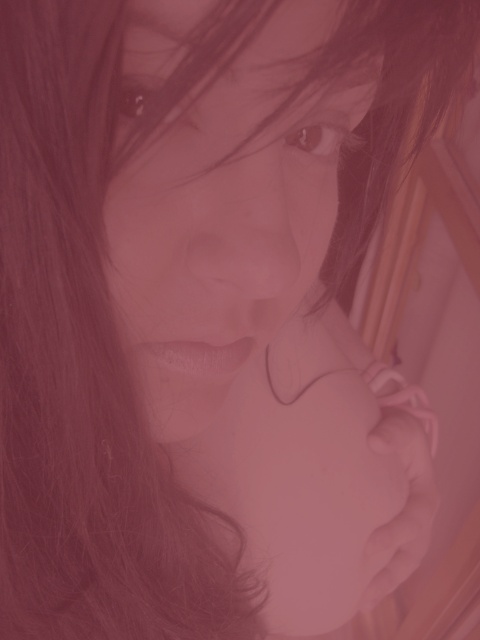
Measure the distance between smooth skin nose at center and camera.

A distance of 22.77 centimeters exists between smooth skin nose at center and camera.

Is smooth skin nose at center taller than matte black eye at upper center?

Yes, smooth skin nose at center is taller than matte black eye at upper center.

Where is `smooth skin nose at center`? The width and height of the screenshot is (480, 640). smooth skin nose at center is located at coordinates (243, 227).

Is smooth skin face at center above matte black eye at upper center?

Actually, smooth skin face at center is below matte black eye at upper center.

Who is taller, smooth skin face at center or matte black eye at upper center?

smooth skin face at center is taller.

Is point (294, 177) positioned after point (119, 104)?

Yes, point (294, 177) is behind point (119, 104).

Locate an element on the screen. The image size is (480, 640). smooth skin face at center is located at coordinates (228, 216).

Is point (311, 147) positioned before point (124, 102)?

No.

Does brown glossy eye at upper center appear on the right side of matte brown eye at upper center?

Indeed, brown glossy eye at upper center is positioned on the right side of matte brown eye at upper center.

Does point (286, 141) come closer to viewer compared to point (144, 108)?

No, (286, 141) is behind (144, 108).

Locate an element on the screen. The image size is (480, 640). brown glossy eye at upper center is located at coordinates (317, 136).